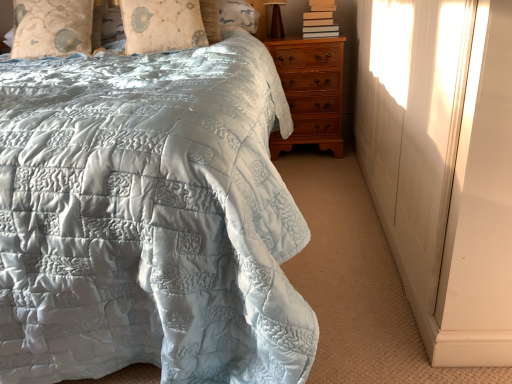
The image size is (512, 384). Describe the element at coordinates (148, 219) in the screenshot. I see `matte quilted bedspread at center` at that location.

Locate an element on the screen. matte quilted bedspread at center is located at coordinates (148, 219).

In order to click on silky beige pillow at upper center, the 1th pillow in the right-to-left sequence in this screenshot , I will do `click(162, 25)`.

Identify the location of matte quilted bedspread at center. The image size is (512, 384). (148, 219).

From a real-world perspective, is light brown wood chest of drawers at right on matte quilted bedspread at center?

No.

Which point is more distant from viewer, (293, 111) or (309, 339)?

The point (293, 111) is more distant.

Is light brown wood chest of drawers at right facing towards matte quilted bedspread at center?

Yes, light brown wood chest of drawers at right is facing matte quilted bedspread at center.

Is light brown wood chest of drawers at right closer to the viewer compared to matte quilted bedspread at center?

That is False.

This screenshot has height=384, width=512. What are the coordinates of `the chest of drawers lying above the matte quilted bedspread at center (from the image's perspective)` in the screenshot? It's located at (310, 91).

Between matte quilted bedspread at center and light brown wood chest of drawers at right, which one has smaller width?

Thinner between the two is light brown wood chest of drawers at right.

How different are the orientations of light blue quilted pillow at upper left, arranged as the first pillow when viewed from the left, and hardcover books at upper right in degrees?

0.451 degrees separate the facing orientations of light blue quilted pillow at upper left, arranged as the first pillow when viewed from the left, and hardcover books at upper right.

From a real-world perspective, is light blue quilted pillow at upper left, marked as the 2th pillow in a right-to-left arrangement, under hardcover books at upper right?

No, from a real-world perspective, light blue quilted pillow at upper left, marked as the 2th pillow in a right-to-left arrangement, is not under hardcover books at upper right.

This screenshot has width=512, height=384. In order to click on book located underneath the light blue quilted pillow at upper left, arranged as the first pillow when viewed from the left (from a real-world perspective) in this screenshot , I will do `click(320, 20)`.

Between light blue quilted pillow at upper left, arranged as the first pillow when viewed from the left, and hardcover books at upper right, which one has larger size?

light blue quilted pillow at upper left, arranged as the first pillow when viewed from the left.

What's the angular difference between matte quilted bedspread at center and hardcover books at upper right's facing directions?

matte quilted bedspread at center and hardcover books at upper right are facing 3.62e-05 degrees away from each other.

Based on their sizes in the image, would you say matte quilted bedspread at center is bigger or smaller than hardcover books at upper right?

Clearly, matte quilted bedspread at center is larger in size than hardcover books at upper right.

Does point (199, 190) appear closer or farther from the camera than point (331, 35)?

Point (199, 190) appears to be closer to the viewer than point (331, 35).

Which object is thinner, hardcover books at upper right or brown wooden table lamp at upper right?

With smaller width is brown wooden table lamp at upper right.

From the picture: From a real-world perspective, between hardcover books at upper right and brown wooden table lamp at upper right, who is vertically higher?

In real-world perspective, brown wooden table lamp at upper right is above.

Do you think hardcover books at upper right is within brown wooden table lamp at upper right, or outside of it?

hardcover books at upper right exists outside the volume of brown wooden table lamp at upper right.

Identify the location of table lamp lying above the hardcover books at upper right (from the image's perspective). (276, 18).

Would you say light brown wood chest of drawers at right is outside hardcover books at upper right?

That's correct, light brown wood chest of drawers at right is outside of hardcover books at upper right.

Which object is thinner, light brown wood chest of drawers at right or hardcover books at upper right?

hardcover books at upper right.

Measure the distance from light brown wood chest of drawers at right to hardcover books at upper right.

light brown wood chest of drawers at right is 12.33 inches from hardcover books at upper right.

Identify the location of the 2nd pillow below the brown wooden table lamp at upper right (from a real-world perspective). This screenshot has width=512, height=384. (162, 25).

Considering the relative sizes of brown wooden table lamp at upper right and silky beige pillow at upper center, arranged as the second pillow when viewed from the left, in the image provided, is brown wooden table lamp at upper right bigger than silky beige pillow at upper center, arranged as the second pillow when viewed from the left,?

Incorrect, brown wooden table lamp at upper right is not larger than silky beige pillow at upper center, arranged as the second pillow when viewed from the left.

From the picture: From a real-world perspective, who is located lower, brown wooden table lamp at upper right or silky beige pillow at upper center, arranged as the second pillow when viewed from the left?

In real-world perspective, silky beige pillow at upper center, arranged as the second pillow when viewed from the left, is lower.

Would you say brown wooden table lamp at upper right is outside silky beige pillow at upper center, arranged as the second pillow when viewed from the left?

brown wooden table lamp at upper right lies outside silky beige pillow at upper center, arranged as the second pillow when viewed from the left,'s area.

Find the location of `bed below the light brown wood chest of drawers at right (from the image's perspective)`. bed below the light brown wood chest of drawers at right (from the image's perspective) is located at coordinates (148, 219).

Where is `the chest of drawers that is above the matte quilted bedspread at center (from the image's perspective)`? the chest of drawers that is above the matte quilted bedspread at center (from the image's perspective) is located at coordinates (310, 91).

Considering their positions, is light brown wood chest of drawers at right positioned further to silky beige pillow at upper center, arranged as the second pillow when viewed from the left, than light blue quilted pillow at upper left, marked as the 2th pillow in a right-to-left arrangement?

light brown wood chest of drawers at right is further to silky beige pillow at upper center, arranged as the second pillow when viewed from the left.

Looking at the image, which one is located closer to light brown wood chest of drawers at right, silky beige pillow at upper center, arranged as the second pillow when viewed from the left, or brown wooden table lamp at upper right?

The object closer to light brown wood chest of drawers at right is brown wooden table lamp at upper right.

Considering their positions, is light brown wood chest of drawers at right positioned further to hardcover books at upper right than silky beige pillow at upper center, arranged as the second pillow when viewed from the left?

Among the two, silky beige pillow at upper center, arranged as the second pillow when viewed from the left, is located further to hardcover books at upper right.

Looking at the image, which one is located closer to light blue quilted pillow at upper left, marked as the 2th pillow in a right-to-left arrangement, silky beige pillow at upper center, the 1th pillow in the right-to-left sequence, or light brown wood chest of drawers at right?

silky beige pillow at upper center, the 1th pillow in the right-to-left sequence, lies closer to light blue quilted pillow at upper left, marked as the 2th pillow in a right-to-left arrangement, than the other object.

When comparing their distances from light brown wood chest of drawers at right, does matte quilted bedspread at center or light blue quilted pillow at upper left, arranged as the first pillow when viewed from the left, seem further?

Based on the image, matte quilted bedspread at center appears to be further to light brown wood chest of drawers at right.

Considering their positions, is light brown wood chest of drawers at right positioned closer to brown wooden table lamp at upper right than hardcover books at upper right?

Based on the image, hardcover books at upper right appears to be nearer to brown wooden table lamp at upper right.

From the image, which object appears to be nearer to matte quilted bedspread at center, brown wooden table lamp at upper right or light brown wood chest of drawers at right?

light brown wood chest of drawers at right is closer to matte quilted bedspread at center.

Which object lies nearer to the anchor point light blue quilted pillow at upper left, arranged as the first pillow when viewed from the left, matte quilted bedspread at center or brown wooden table lamp at upper right?

The object closer to light blue quilted pillow at upper left, arranged as the first pillow when viewed from the left, is brown wooden table lamp at upper right.

Image resolution: width=512 pixels, height=384 pixels. Find the location of `pillow between light blue quilted pillow at upper left, marked as the 2th pillow in a right-to-left arrangement, and brown wooden table lamp at upper right`. pillow between light blue quilted pillow at upper left, marked as the 2th pillow in a right-to-left arrangement, and brown wooden table lamp at upper right is located at coordinates (162, 25).

I want to click on book between matte quilted bedspread at center and brown wooden table lamp at upper right in the front-back direction, so click(320, 20).

Locate an element on the screen. The image size is (512, 384). book between matte quilted bedspread at center and light brown wood chest of drawers at right from front to back is located at coordinates (320, 20).

You are a GUI agent. You are given a task and a screenshot of the screen. Output one action in this format:
    pyautogui.click(x=<x>, y=<y>)
    Task: Click on the chest of drawers positioned between matte quilted bedspread at center and brown wooden table lamp at upper right from near to far
    This screenshot has width=512, height=384.
    Given the screenshot: What is the action you would take?
    pyautogui.click(x=310, y=91)